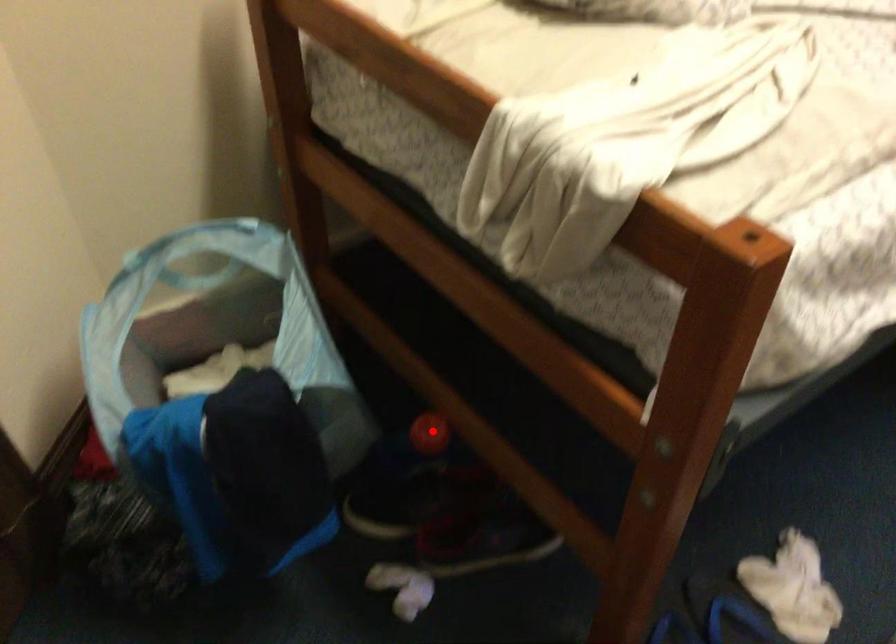
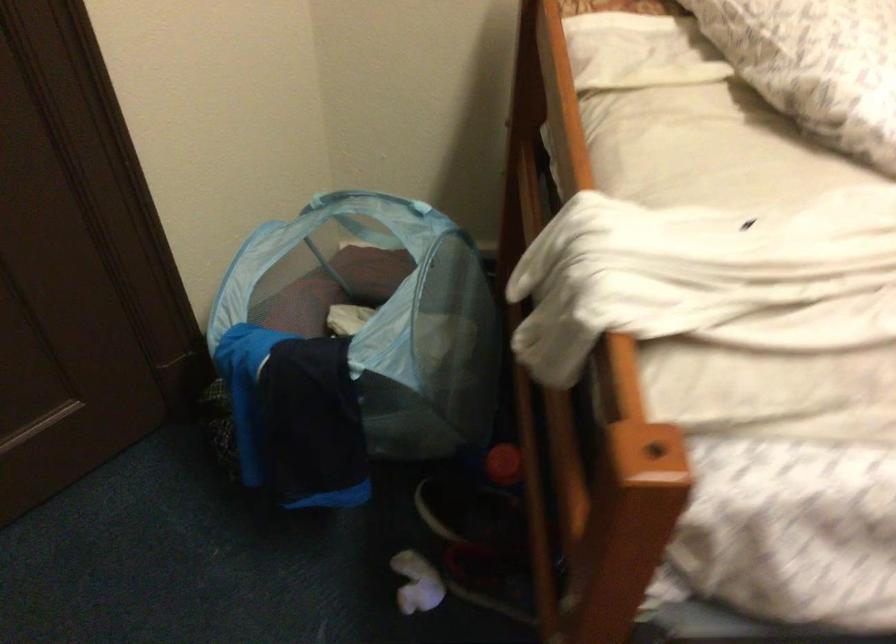
In the second image, find the point that corresponds to the highlighted location in the first image.

(504, 464)